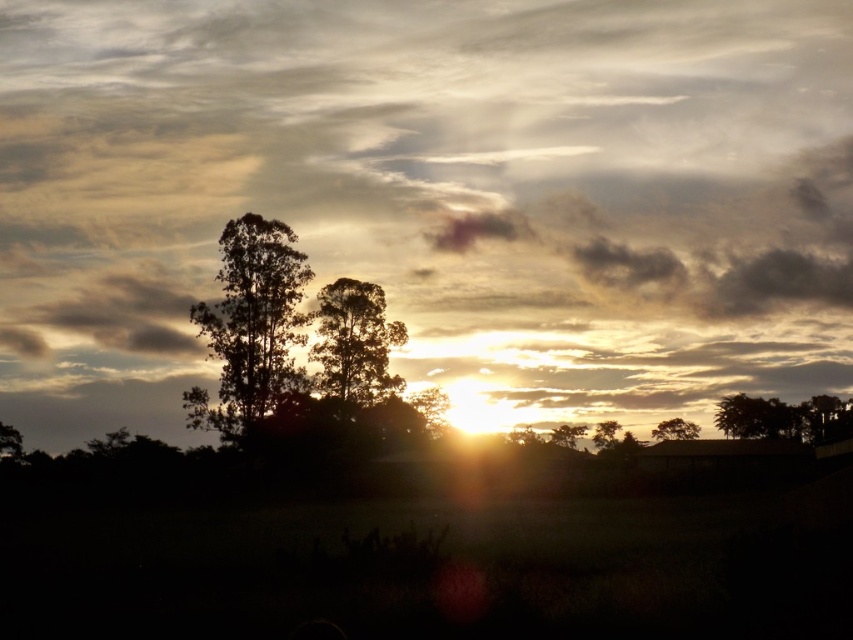
Question: Which of the following is the closest to the observer?

Choices:
 (A) (604, 426)
 (B) (221, 262)
 (C) (674, 433)
 (D) (727, 166)

Answer: (B)

Question: Can you confirm if silhouette leafy tree at left is positioned to the left of silvery metallic tree at upper right?

Choices:
 (A) no
 (B) yes

Answer: (B)

Question: Considering the relative positions of silhouette leafy tree at left and silvery metallic tree at upper right in the image provided, where is silhouette leafy tree at left located with respect to silvery metallic tree at upper right?

Choices:
 (A) above
 (B) below

Answer: (A)

Question: Which point is farther from the camera taking this photo?

Choices:
 (A) (775, 413)
 (B) (596, 436)
 (C) (660, 433)

Answer: (C)

Question: Where is silhouette leafy tree at left located in relation to silvery metallic tree at lower right in the image?

Choices:
 (A) right
 (B) left

Answer: (B)

Question: Which object is the farthest from the silvery metallic tree at lower right?

Choices:
 (A) silvery metallic tree at upper right
 (B) silhouette wood tree at center
 (C) silvery metallic tree at center

Answer: (B)